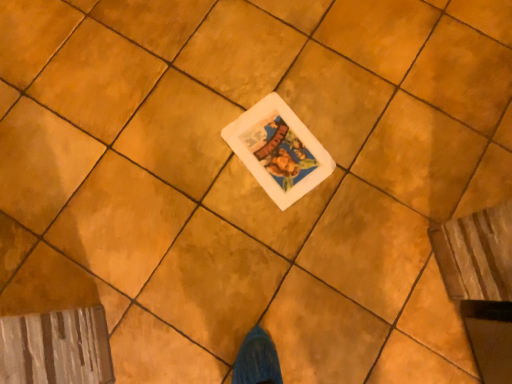
Where is `white matte comic book at center`? The image size is (512, 384). white matte comic book at center is located at coordinates (278, 150).

What do you see at coordinates (278, 150) in the screenshot? The image size is (512, 384). I see `white matte comic book at center` at bounding box center [278, 150].

This screenshot has width=512, height=384. In order to click on white matte comic book at center in this screenshot , I will do `click(278, 150)`.